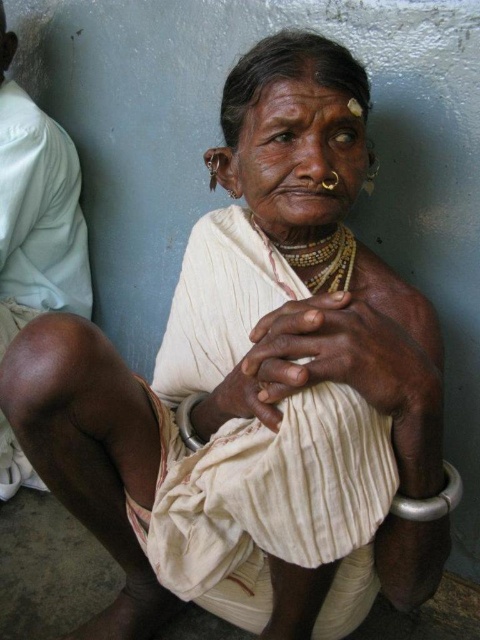
You are an anthropologist studying traditional attire. You observe the brown skin at lower left and the silver metallic bracelet at lower right on the woman. Based on their positions, can you determine which object is closer to the bottom of the image?

The silver metallic bracelet at lower right is closer to the bottom of the image because the brown skin at lower left is located above it.

You are an artist trying to sketch this scene. You need to place the brown skin at lower left accurately. According to the coordinates provided, where should you position it on your drawing canvas?

The brown skin at lower left should be positioned at coordinates point (36, 209) on the drawing canvas.